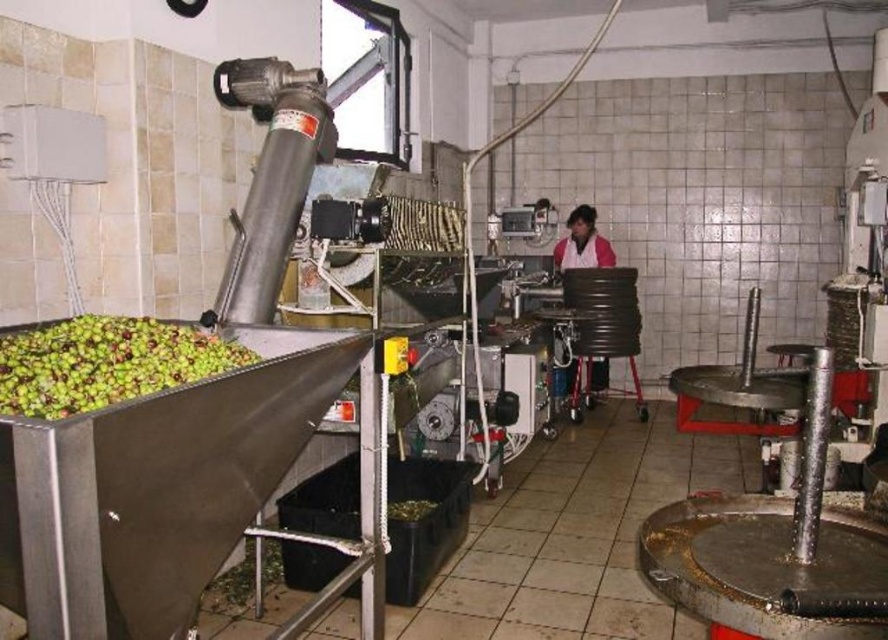
Looking at this image, you are an inspector checking the olive oil production line. You notice the green matte olives at left and the pink fabric at center. Which object is shorter in height?

The green matte olives at left has a lesser height compared to the pink fabric at center, so the green matte olives at left is shorter in height.

You are an inspector checking the olive oil production facility. You notice the green matte olives at left and the pink fabric at center. Which object is larger in size?

The pink fabric at center is larger than the green matte olives at left.

You are an inspector checking the olive oil production line. You notice the green matte olives at left and the pink fabric at center. Which object is positioned lower in the scene?

The green matte olives at left are positioned lower than the pink fabric at center.